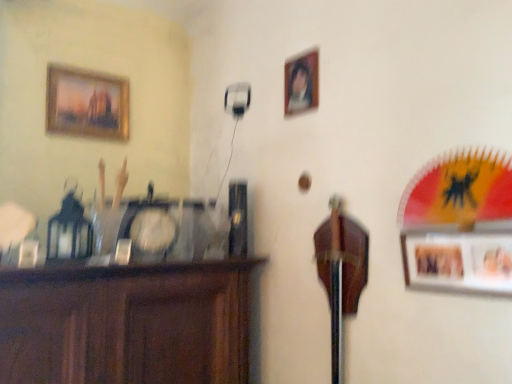
What do you see at coordinates (301, 83) in the screenshot?
I see `wooden portrait frame at upper center, which is the 2th picture frame in front-to-back order` at bounding box center [301, 83].

The image size is (512, 384). What do you see at coordinates (86, 103) in the screenshot?
I see `gold-framed painting at upper left, which is the first picture frame in left-to-right order` at bounding box center [86, 103].

This screenshot has height=384, width=512. Find the location of `wooden photo frame at right, the 1th picture frame in the right-to-left sequence`. wooden photo frame at right, the 1th picture frame in the right-to-left sequence is located at coordinates [x=458, y=262].

From the image's perspective, between wooden photo frame at right, which is counted as the 1th picture frame, starting from the front, and wooden portrait frame at upper center, marked as the 1th picture frame in a top-to-bottom arrangement, which one is located above?

wooden portrait frame at upper center, marked as the 1th picture frame in a top-to-bottom arrangement, from the image's perspective.

Does point (447, 257) come behind point (296, 99)?

No, it is in front of (296, 99).

Between wooden photo frame at right, the first picture frame when ordered from bottom to top, and wooden portrait frame at upper center, which is the 2th picture frame in front-to-back order, which one has smaller width?

wooden portrait frame at upper center, which is the 2th picture frame in front-to-back order, is thinner.

Considering the sizes of objects gold-framed painting at upper left, which is the first picture frame from back to front, and brown wood cabinet at left in the image provided, who is smaller, gold-framed painting at upper left, which is the first picture frame from back to front, or brown wood cabinet at left?

Smaller between the two is gold-framed painting at upper left, which is the first picture frame from back to front.

Considering the sizes of objects gold-framed painting at upper left, which appears as the second picture frame when viewed from the top, and brown wood cabinet at left in the image provided, who is wider, gold-framed painting at upper left, which appears as the second picture frame when viewed from the top, or brown wood cabinet at left?

brown wood cabinet at left is wider.

Is gold-framed painting at upper left, the third picture frame from the front, taller or shorter than brown wood cabinet at left?

gold-framed painting at upper left, the third picture frame from the front, is shorter than brown wood cabinet at left.

Is gold-framed painting at upper left, which appears as the third picture frame when viewed from the right, behind brown wood cabinet at left?

Yes.

Is gold-framed painting at upper left, which is the first picture frame from back to front, located within brown wood cabinet at left?

No, gold-framed painting at upper left, which is the first picture frame from back to front, is located outside of brown wood cabinet at left.

From the image's perspective, is brown wood cabinet at left below gold-framed painting at upper left, marked as the 2th picture frame in a bottom-to-top arrangement?

Indeed, from the image's perspective, brown wood cabinet at left is shown beneath gold-framed painting at upper left, marked as the 2th picture frame in a bottom-to-top arrangement.

From a real-world perspective, is brown wood cabinet at left above or below gold-framed painting at upper left, which appears as the second picture frame when viewed from the top?

Clearly, from a real-world perspective, brown wood cabinet at left is below gold-framed painting at upper left, which appears as the second picture frame when viewed from the top.

Is brown wood cabinet at left closer to camera compared to gold-framed painting at upper left, the third picture frame from the front?

Yes, brown wood cabinet at left is closer to the viewer.

Consider the image. Which of these two, wooden portrait frame at upper center, the second picture frame in the back-to-front sequence, or gold-framed painting at upper left, which appears as the third picture frame when viewed from the right, is bigger?

Bigger between the two is gold-framed painting at upper left, which appears as the third picture frame when viewed from the right.

From the picture: Which object is further away from the camera taking this photo, wooden portrait frame at upper center, arranged as the second picture frame when viewed from the left, or gold-framed painting at upper left, the third picture frame from the front?

gold-framed painting at upper left, the third picture frame from the front, is behind.

Does wooden portrait frame at upper center, which is the 2th picture frame in front-to-back order, have a greater width compared to gold-framed painting at upper left, which is the first picture frame in left-to-right order?

No, wooden portrait frame at upper center, which is the 2th picture frame in front-to-back order, is not wider than gold-framed painting at upper left, which is the first picture frame in left-to-right order.

Is gold-framed painting at upper left, which is the first picture frame from back to front, at the back of wooden portrait frame at upper center, the second picture frame from the right?

wooden portrait frame at upper center, the second picture frame from the right, is not turned away from gold-framed painting at upper left, which is the first picture frame from back to front.

Between point (179, 351) and point (437, 283), which one is positioned behind?

The point (179, 351) is more distant.

Which is more to the left, brown wood cabinet at left or wooden photo frame at right, the 1th picture frame in the right-to-left sequence?

brown wood cabinet at left.

Does brown wood cabinet at left have a greater height compared to wooden photo frame at right, the first picture frame when ordered from bottom to top?

Correct, brown wood cabinet at left is much taller as wooden photo frame at right, the first picture frame when ordered from bottom to top.

From the image's perspective, is brown wood cabinet at left below wooden photo frame at right, which is counted as the 1th picture frame, starting from the front?

Yes.

Can you confirm if gold-framed painting at upper left, the third picture frame from the front, is positioned to the left of wooden photo frame at right, the first picture frame when ordered from bottom to top?

Yes, gold-framed painting at upper left, the third picture frame from the front, is to the left of wooden photo frame at right, the first picture frame when ordered from bottom to top.

Can we say gold-framed painting at upper left, which is the first picture frame from back to front, lies outside wooden photo frame at right, which is counted as the third picture frame, starting from the top?

Yes.

Can you confirm if gold-framed painting at upper left, which is the first picture frame in left-to-right order, is wider than wooden photo frame at right, which is counted as the third picture frame, starting from the top?

Correct, the width of gold-framed painting at upper left, which is the first picture frame in left-to-right order, exceeds that of wooden photo frame at right, which is counted as the third picture frame, starting from the top.

From a real-world perspective, which object stands above the other?

gold-framed painting at upper left, which is the first picture frame from back to front.

Is wooden photo frame at right, which is the 3th picture frame from back to front, inside or outside of brown wood cabinet at left?

wooden photo frame at right, which is the 3th picture frame from back to front, cannot be found inside brown wood cabinet at left.

From a real-world perspective, between wooden photo frame at right, the first picture frame when ordered from bottom to top, and brown wood cabinet at left, who is vertically lower?

From a 3D spatial view, brown wood cabinet at left is below.

Is wooden photo frame at right, which is the 3th picture frame from back to front, positioned behind brown wood cabinet at left?

No.

Is wooden photo frame at right, which is counted as the 1th picture frame, starting from the front, oriented away from brown wood cabinet at left?

No, wooden photo frame at right, which is counted as the 1th picture frame, starting from the front, is not facing the opposite direction of brown wood cabinet at left.

I want to click on the 1st picture frame directly above the wooden photo frame at right, the first picture frame when ordered from bottom to top (from a real-world perspective), so click(x=301, y=83).

Where is `furniture below the gold-framed painting at upper left, which appears as the third picture frame when viewed from the right (from a real-world perspective)`? furniture below the gold-framed painting at upper left, which appears as the third picture frame when viewed from the right (from a real-world perspective) is located at coordinates (127, 323).

From the image, which object appears to be nearer to wooden photo frame at right, the first picture frame when ordered from bottom to top, wooden portrait frame at upper center, which is the third picture frame from bottom to top, or brown wood cabinet at left?

Among the two, wooden portrait frame at upper center, which is the third picture frame from bottom to top, is located nearer to wooden photo frame at right, the first picture frame when ordered from bottom to top.

Which object lies further to the anchor point wooden portrait frame at upper center, arranged as the second picture frame when viewed from the left, brown wood cabinet at left or gold-framed painting at upper left, which appears as the second picture frame when viewed from the top?

gold-framed painting at upper left, which appears as the second picture frame when viewed from the top, is positioned further to the anchor wooden portrait frame at upper center, arranged as the second picture frame when viewed from the left.

Considering their positions, is wooden portrait frame at upper center, the second picture frame from the right, positioned closer to brown wood cabinet at left than gold-framed painting at upper left, the third picture frame from the front?

The object closer to brown wood cabinet at left is wooden portrait frame at upper center, the second picture frame from the right.

When comparing their distances from wooden photo frame at right, which is counted as the third picture frame, starting from the top, does gold-framed painting at upper left, which appears as the second picture frame when viewed from the top, or wooden portrait frame at upper center, the second picture frame from the right, seem closer?

wooden portrait frame at upper center, the second picture frame from the right, is closer to wooden photo frame at right, which is counted as the third picture frame, starting from the top.

Looking at the image, which one is located further to gold-framed painting at upper left, which appears as the second picture frame when viewed from the top, wooden portrait frame at upper center, the second picture frame from the right, or brown wood cabinet at left?

The object further to gold-framed painting at upper left, which appears as the second picture frame when viewed from the top, is brown wood cabinet at left.

Estimate the real-world distances between objects in this image. Which object is closer to brown wood cabinet at left, gold-framed painting at upper left, which appears as the second picture frame when viewed from the top, or wooden photo frame at right, acting as the third picture frame starting from the left?

wooden photo frame at right, acting as the third picture frame starting from the left, is closer to brown wood cabinet at left.

Which object lies further to the anchor point wooden photo frame at right, which is the 3th picture frame from back to front, wooden portrait frame at upper center, marked as the 1th picture frame in a top-to-bottom arrangement, or gold-framed painting at upper left, the third picture frame from the front?

The object further to wooden photo frame at right, which is the 3th picture frame from back to front, is gold-framed painting at upper left, the third picture frame from the front.

Looking at the image, which one is located further to brown wood cabinet at left, wooden photo frame at right, acting as the third picture frame starting from the left, or gold-framed painting at upper left, which appears as the second picture frame when viewed from the top?

gold-framed painting at upper left, which appears as the second picture frame when viewed from the top, is positioned further to the anchor brown wood cabinet at left.

Image resolution: width=512 pixels, height=384 pixels. Find the location of `picture frame between brown wood cabinet at left and wooden photo frame at right, which is counted as the 1th picture frame, starting from the front, in the horizontal direction`. picture frame between brown wood cabinet at left and wooden photo frame at right, which is counted as the 1th picture frame, starting from the front, in the horizontal direction is located at coordinates (301, 83).

You are a GUI agent. You are given a task and a screenshot of the screen. Output one action in this format:
    pyautogui.click(x=<x>, y=<y>)
    Task: Click on the furniture located between gold-framed painting at upper left, which appears as the third picture frame when viewed from the right, and wooden photo frame at right, acting as the third picture frame starting from the left, in the left-right direction
    The image size is (512, 384).
    Given the screenshot: What is the action you would take?
    pyautogui.click(x=127, y=323)

Where is `picture frame between gold-framed painting at upper left, which appears as the second picture frame when viewed from the top, and wooden photo frame at right, which is counted as the 1th picture frame, starting from the front`? This screenshot has height=384, width=512. picture frame between gold-framed painting at upper left, which appears as the second picture frame when viewed from the top, and wooden photo frame at right, which is counted as the 1th picture frame, starting from the front is located at coordinates (301, 83).